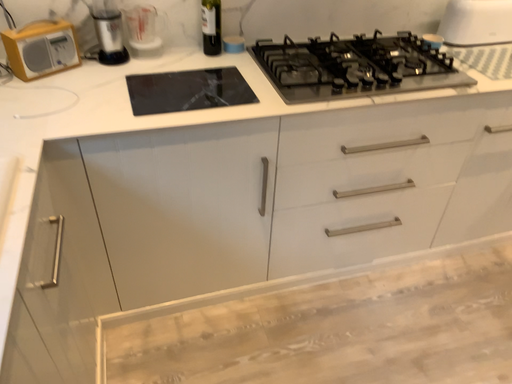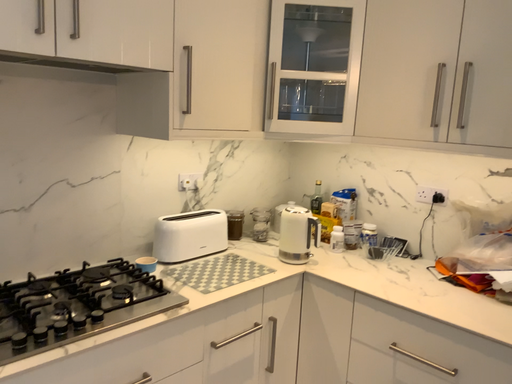
Question: Which way did the camera rotate in the video?

Choices:
 (A) rotated upward
 (B) rotated downward

Answer: (A)